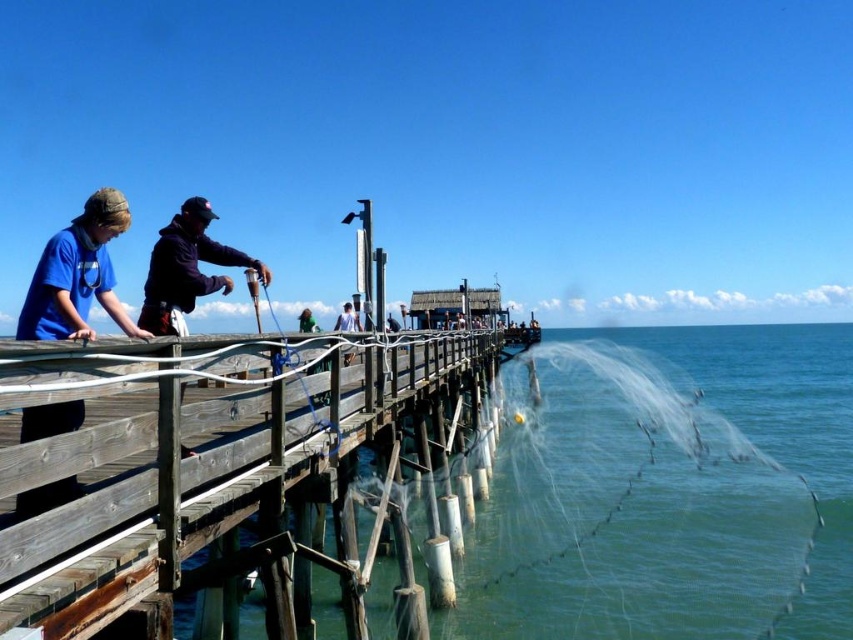
You are standing on the wooden pier and want to retrieve the transparent nylon fishing net at lower right without disturbing the dark blue hoodie at center. Considering their sizes, which object should you handle with more care to avoid knocking over the other?

The transparent nylon fishing net at lower right is larger than the dark blue hoodie at center. To avoid knocking over the dark blue hoodie at center, you should handle the transparent nylon fishing net at lower right with more care due to its larger size.

You are standing on the wooden pier and want to retrieve your fishing net without disturbing the person in the dark blue hoodie at center. Which direction should you move to reach the transparent nylon fishing net at lower right?

The transparent nylon fishing net at lower right is positioned on the right side of the dark blue hoodie at center, so you should move to the right to reach it without disturbing the person.